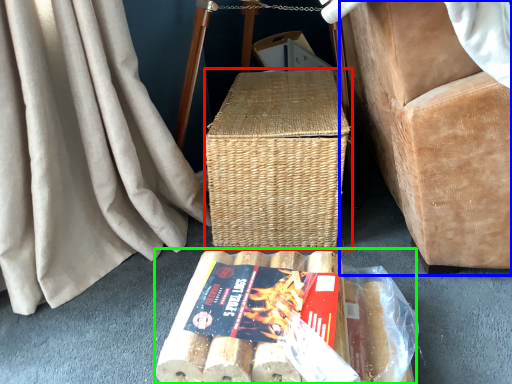
Question: Based on their relative distances, which object is farther from picnic basket (highlighted by a red box)? Choose from furniture (highlighted by a blue box) and food (highlighted by a green box).

Choices:
 (A) furniture
 (B) food

Answer: (B)